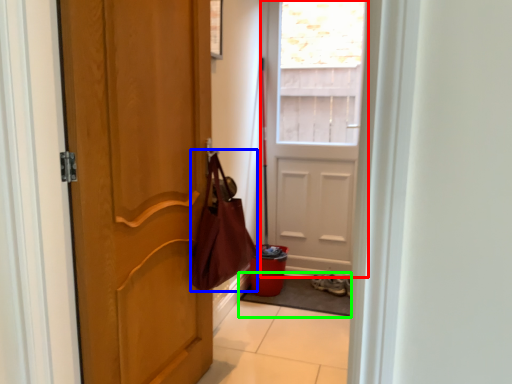
Question: Which object is the farthest from door (highlighted by a red box)? Choose among these: shoulder bag (highlighted by a blue box) or doormat (highlighted by a green box).

Choices:
 (A) shoulder bag
 (B) doormat

Answer: (A)